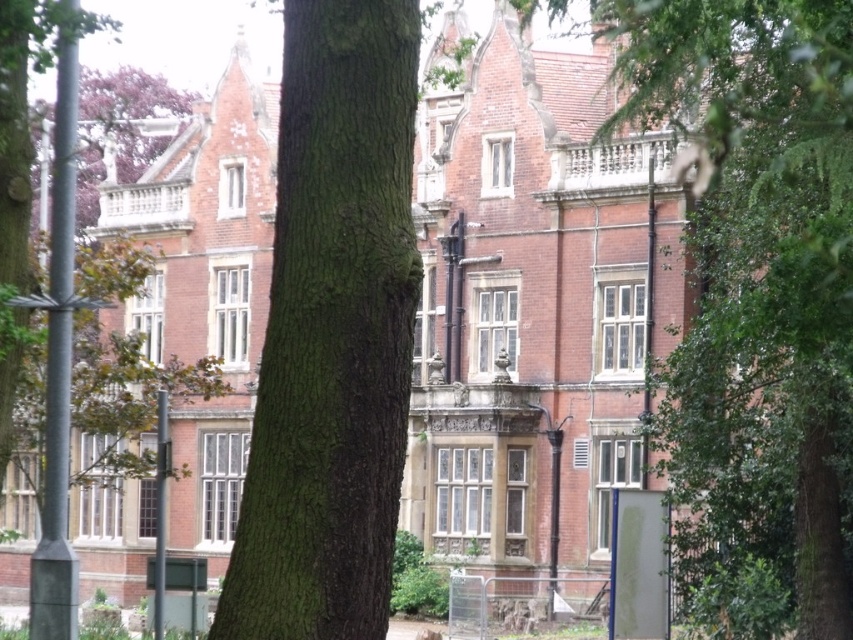
Based on the photo, is green leafy tree at center shorter than green rough bark tree at center?

No, green leafy tree at center is not shorter than green rough bark tree at center.

Identify the location of green leafy tree at center. Image resolution: width=853 pixels, height=640 pixels. (758, 260).

You are a GUI agent. You are given a task and a screenshot of the screen. Output one action in this format:
    pyautogui.click(x=<x>, y=<y>)
    Task: Click on the green leafy tree at center
    The width and height of the screenshot is (853, 640).
    Given the screenshot: What is the action you would take?
    pyautogui.click(x=758, y=260)